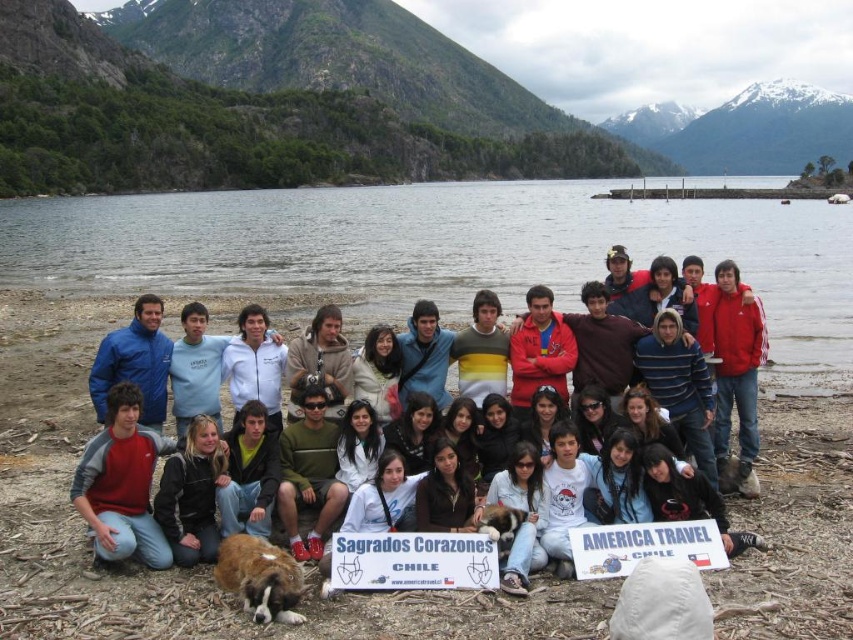
Is point (606, 340) more distant than point (115, 468)?

Yes.

What do you see at coordinates (633, 502) in the screenshot?
I see `matte blue jacket at center` at bounding box center [633, 502].

Identify the location of matte blue jacket at center. Image resolution: width=853 pixels, height=640 pixels. (633, 502).

Does matte blue jacket at center have a greater width compared to black leather jacket at lower left?

Correct, the width of matte blue jacket at center exceeds that of black leather jacket at lower left.

Is matte blue jacket at center further to camera compared to black leather jacket at lower left?

No, matte blue jacket at center is in front of black leather jacket at lower left.

Image resolution: width=853 pixels, height=640 pixels. Find the location of `matte blue jacket at center`. matte blue jacket at center is located at coordinates [x=633, y=502].

Is point (695, 353) positioned after point (606, 540)?

Yes, point (695, 353) is farther from viewer.

Between point (311, 550) and point (720, 554), which one is positioned behind?

Point (311, 550)

Locate an element on the screen. The image size is (853, 640). matte blue jacket at center is located at coordinates (633, 502).